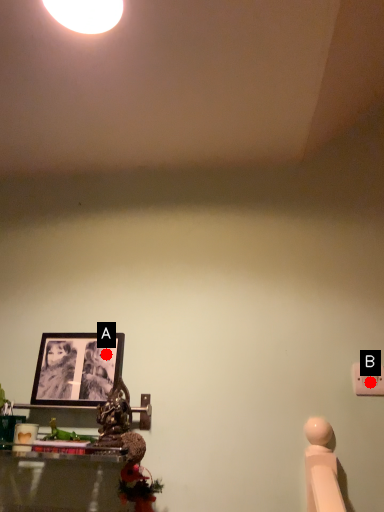
Question: Two points are circled on the image, labeled by A and B beside each circle. Among these points, which one is nearest to the camera?

Choices:
 (A) A is closer
 (B) B is closer

Answer: (B)